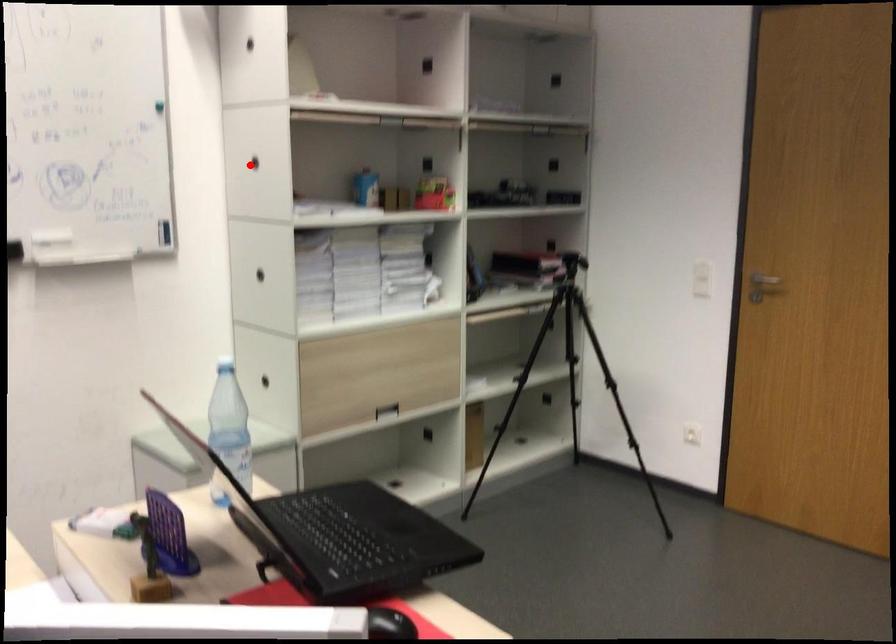
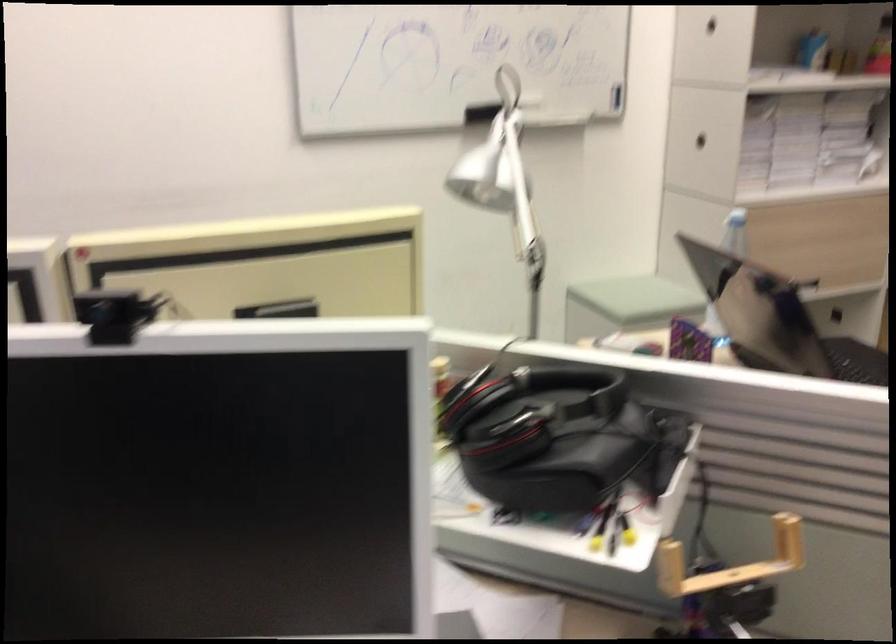
Where in the second image is the point corresponding to the highlighted location from the first image?

(711, 24)